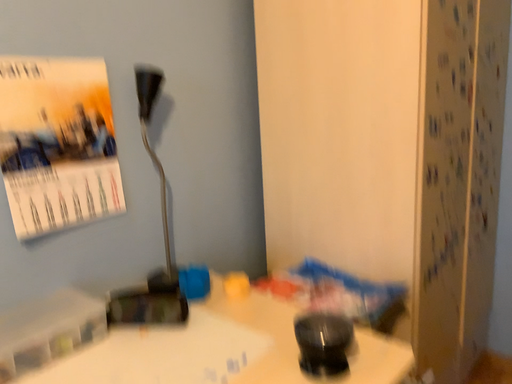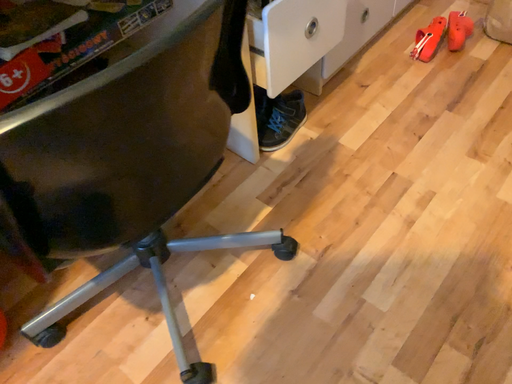
Question: Which way did the camera rotate in the video?

Choices:
 (A) rotated downward
 (B) rotated upward

Answer: (A)